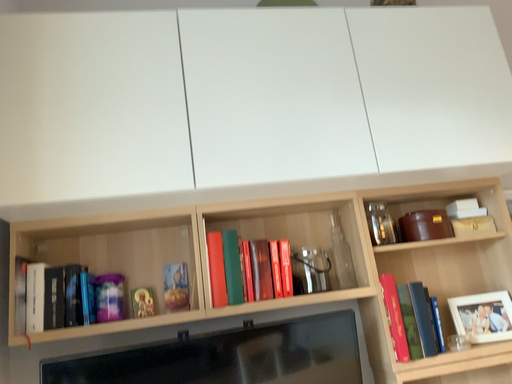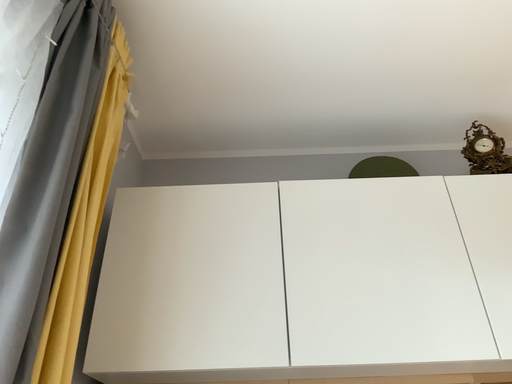
Question: Which way did the camera rotate in the video?

Choices:
 (A) rotated upward
 (B) rotated downward

Answer: (A)